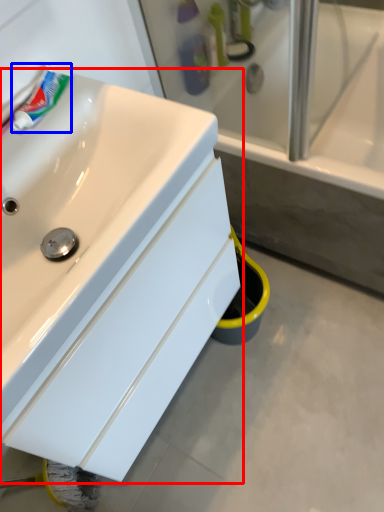
Question: Which object appears farthest to the camera in this image, sink (highlighted by a red box) or toothpaste (highlighted by a blue box)?

Choices:
 (A) sink
 (B) toothpaste

Answer: (B)